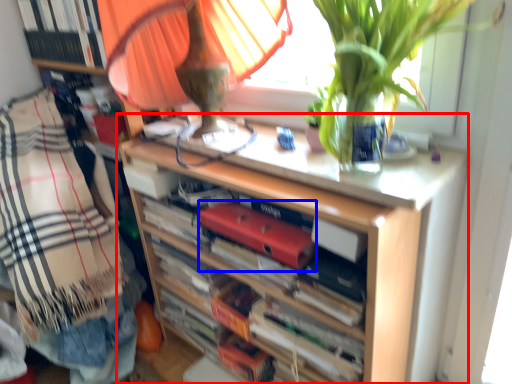
Question: Which of the following is the farthest to the observer, shelf (highlighted by a red box) or paperback book (highlighted by a blue box)?

Choices:
 (A) shelf
 (B) paperback book

Answer: (B)